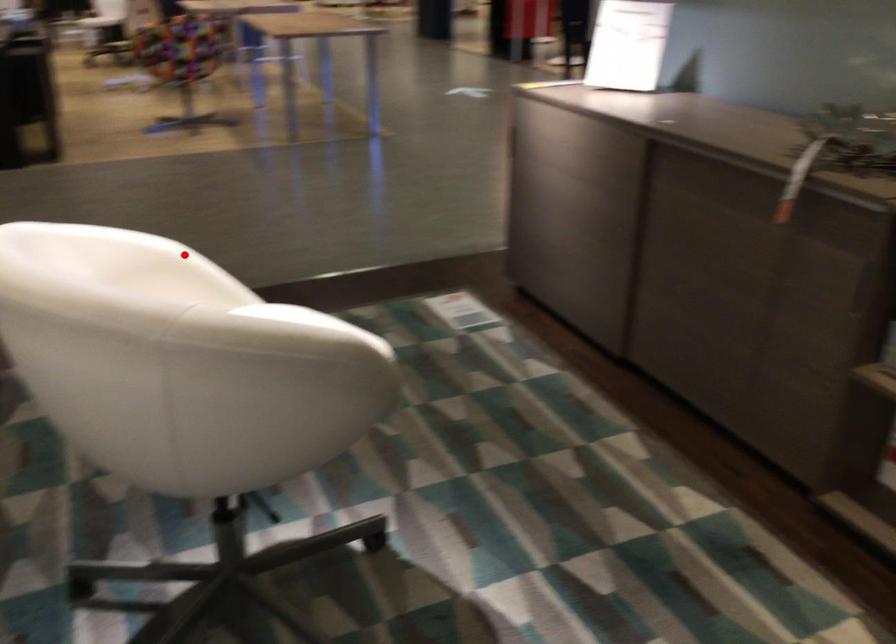
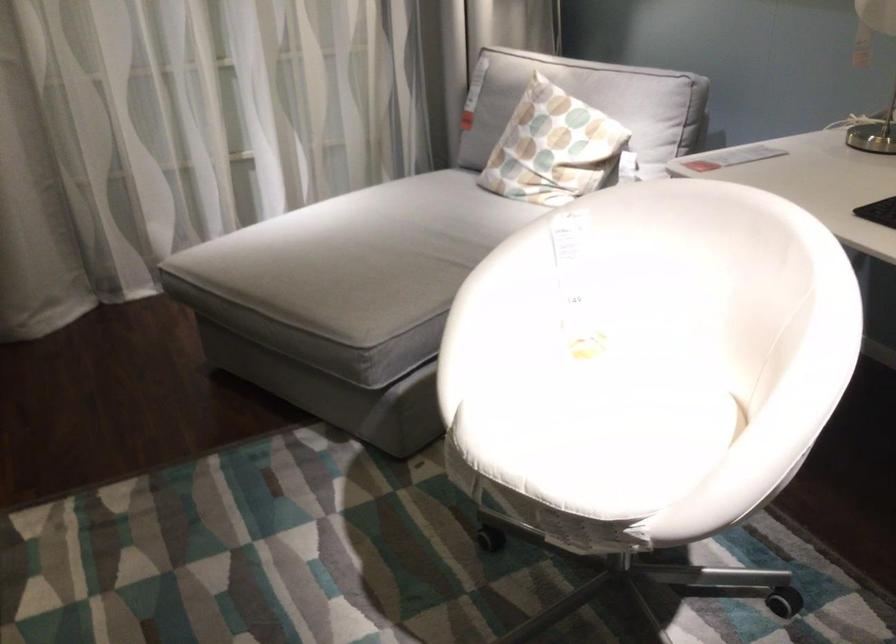
Where in the second image is the point corresponding to the highlighted location from the first image?

(780, 399)